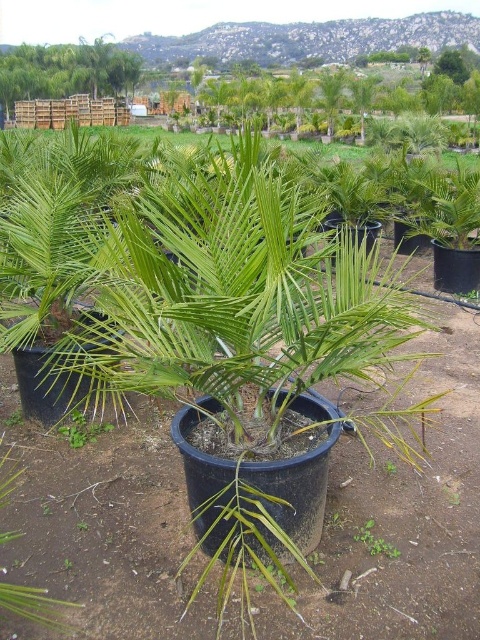
Question: Which point is farther to the camera?

Choices:
 (A) (354, 376)
 (B) (8, 81)

Answer: (B)

Question: Which point is closer to the camera?

Choices:
 (A) green matte palm tree at center
 (B) green leafy plant at upper left

Answer: (A)

Question: Is green matte palm tree at center positioned in front of green leafy plant at upper left?

Choices:
 (A) no
 (B) yes

Answer: (B)

Question: Does green matte palm tree at center appear on the left side of green leafy plant at upper left?

Choices:
 (A) yes
 (B) no

Answer: (B)

Question: Is green matte palm tree at center below green leafy plant at upper left?

Choices:
 (A) no
 (B) yes

Answer: (B)

Question: Among these points, which one is nearest to the camera?

Choices:
 (A) (349, 374)
 (B) (92, 65)

Answer: (A)